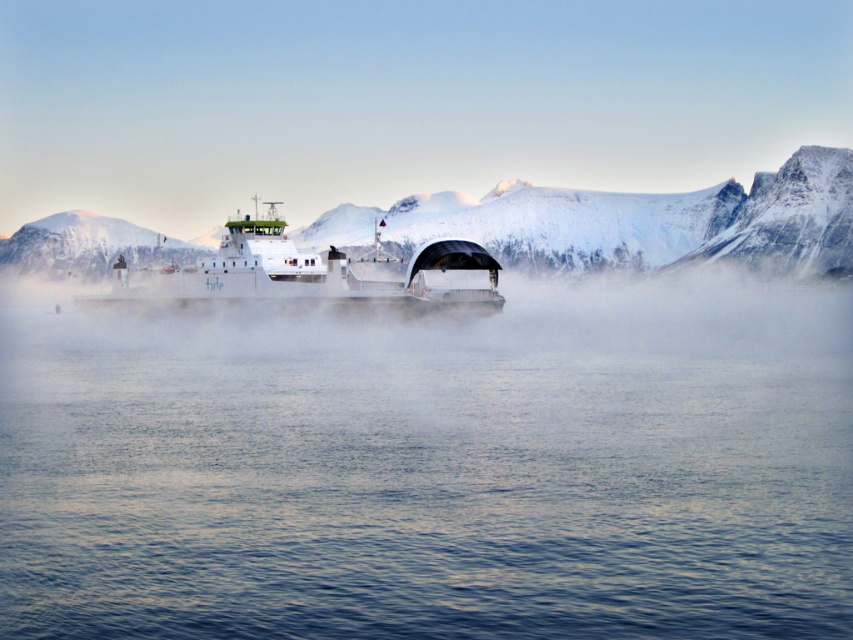
You are standing on the ferry and want to locate two specific points marked on the image. The first point is at coordinate point (270, 209) and the second is at point (38, 224). Which of these two points is closer to you?

Point (270, 209) is closer to the viewer than point (38, 224).

You are a passenger on the ferry and want to locate the point marked at coordinates [305,276]. Based on the scene description, where on the ferry would this point be located?

The point marked at coordinates [305,276] is located on the white matte ferry at center.

You are standing on the deck of the Hurtigruten ferry and want to take a photo of the snow covered mountains in the background. The clear water at center is in your way. If your camera has a depth of field that can focus on objects 150 feet away, will the snow covered mountains be in focus?

The clear water at center is 142.46 feet away from the camera. Since the mountains are further away than the water, and the camera can focus up to 150 feet, the snow covered mountains will be in focus as long as their distance is within the 150 feet range. However, if the mountains are beyond 150 feet, they might not be in focus. The given information only specifies the water distance, so we cannot confirm the mountains distance.